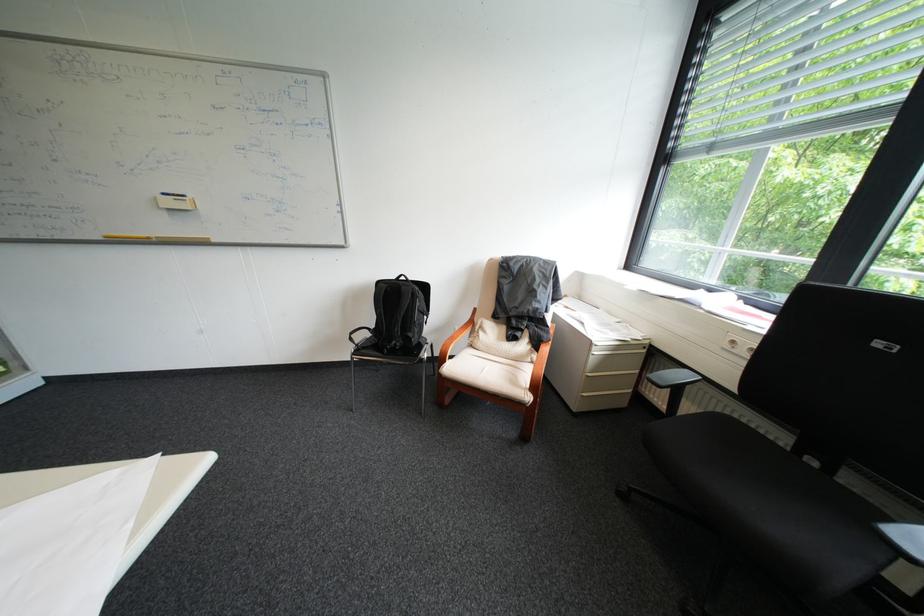
Where is `wooden chair armrest`? This screenshot has height=616, width=924. wooden chair armrest is located at coordinates (453, 341).